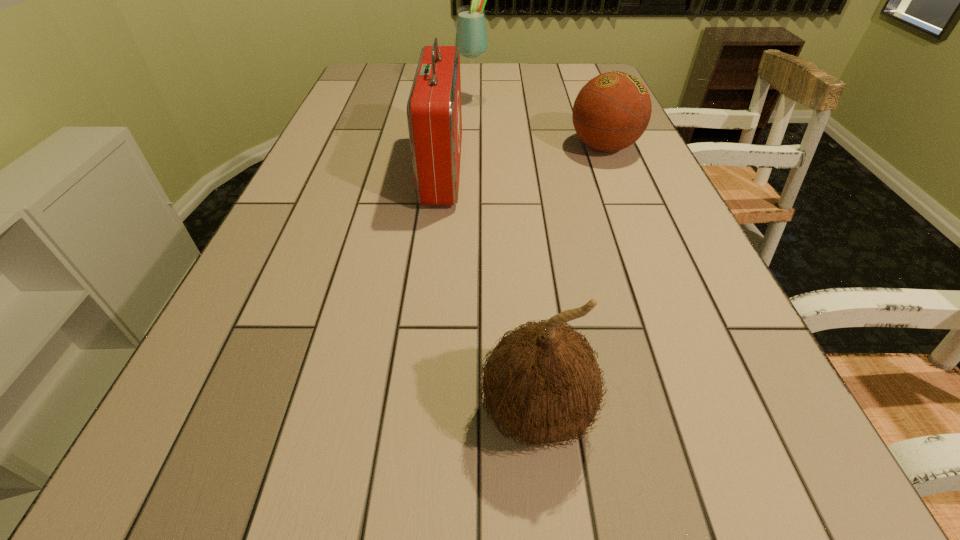
The height and width of the screenshot is (540, 960). I want to click on vacant region between the basketball and the first-aid kit, so click(523, 159).

Locate an element on the screen. This screenshot has height=540, width=960. vacant space in between the shortest object and the farthest object is located at coordinates (539, 124).

This screenshot has width=960, height=540. I want to click on free space between the second shortest object and the first-aid kit, so click(x=490, y=292).

Identify which object is the closest to the first-aid kit. Please provide its 2D coordinates. Your answer should be formatted as a tuple, i.e. [(x, y)], where the tuple contains the x and y coordinates of a point satisfying the conditions above.

[(471, 36)]

Where is `object that ranks as the second closest to the alcohol`? This screenshot has width=960, height=540. object that ranks as the second closest to the alcohol is located at coordinates (611, 112).

Image resolution: width=960 pixels, height=540 pixels. What are the coordinates of `free space that satisfies the following two spatial constraints: 1. on the front side of the rightmost object; 2. on the side of the first-aid kit with the first aid cross symbol` in the screenshot? It's located at (613, 171).